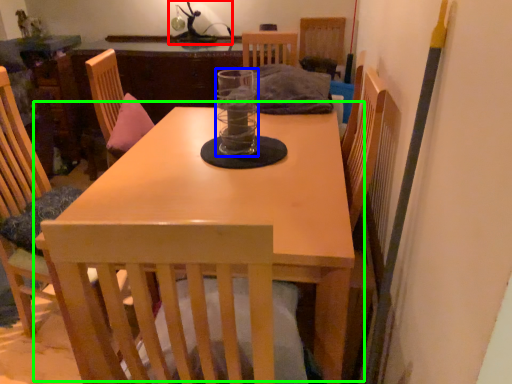
Question: Which object is the farthest from table lamp (highlighted by a red box)? Choose among these: glass jar (highlighted by a blue box) or table (highlighted by a green box).

Choices:
 (A) glass jar
 (B) table

Answer: (B)